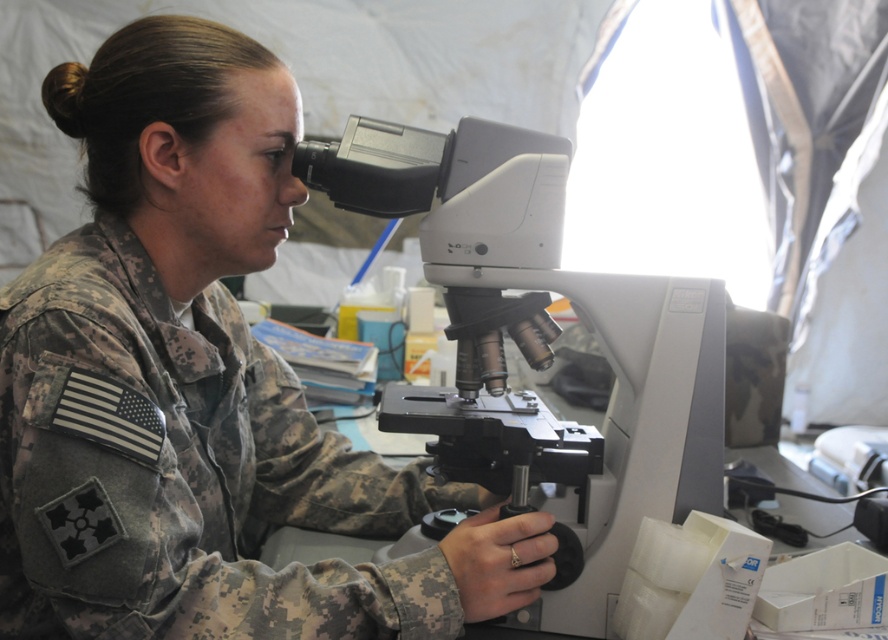
Question: Which of the following is the farthest from the observer?

Choices:
 (A) (236, 444)
 (B) (480, 428)

Answer: (A)

Question: Does camouflage fabric uniform at center have a smaller size compared to white plastic microscope at center?

Choices:
 (A) no
 (B) yes

Answer: (A)

Question: Can you confirm if camouflage fabric uniform at center is wider than white plastic microscope at center?

Choices:
 (A) yes
 (B) no

Answer: (B)

Question: Is camouflage fabric uniform at center to the right of white plastic microscope at center from the viewer's perspective?

Choices:
 (A) yes
 (B) no

Answer: (B)

Question: Which point is closer to the camera taking this photo?

Choices:
 (A) (157, 568)
 (B) (657, 464)

Answer: (A)